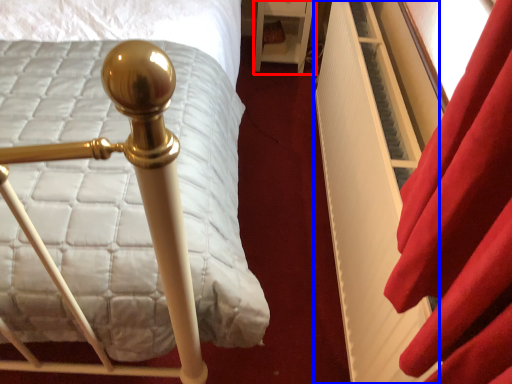
Question: Which object is further to the camera taking this photo, furniture (highlighted by a red box) or bed frame (highlighted by a blue box)?

Choices:
 (A) furniture
 (B) bed frame

Answer: (A)